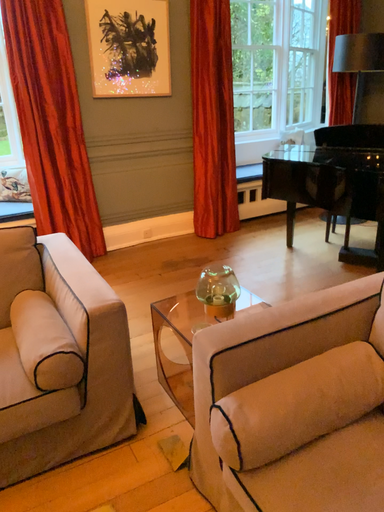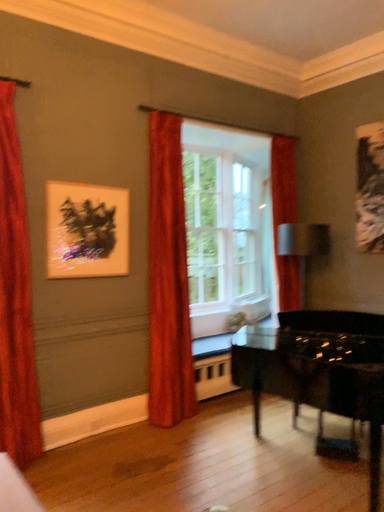
Question: How did the camera likely rotate when shooting the video?

Choices:
 (A) rotated upward
 (B) rotated downward

Answer: (A)